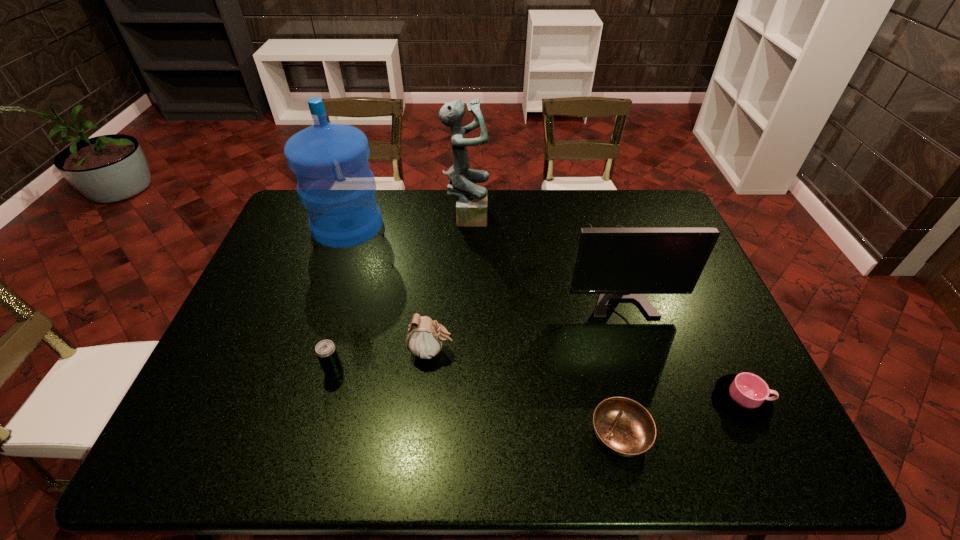
Where is `free space between the water jug and the soup bowl`? The image size is (960, 540). free space between the water jug and the soup bowl is located at coordinates (484, 330).

Image resolution: width=960 pixels, height=540 pixels. What are the coordinates of `empty location between the pouch and the sculpture` in the screenshot? It's located at (449, 283).

You are a GUI agent. You are given a task and a screenshot of the screen. Output one action in this format:
    pyautogui.click(x=<x>, y=<y>)
    Task: Click on the free space between the soup bowl and the sculpture
    This screenshot has height=540, width=960.
    Given the screenshot: What is the action you would take?
    543,325

At what (x,y) coordinates should I click in order to perform the action: click on free spot between the water jug and the third tallest object. Please return your answer as a coordinate pair (x, y). The height and width of the screenshot is (540, 960). Looking at the image, I should click on (480, 248).

Locate an element on the screen. The image size is (960, 540). free space between the third tallest object and the water jug is located at coordinates (480, 248).

You are a GUI agent. You are given a task and a screenshot of the screen. Output one action in this format:
    pyautogui.click(x=<x>, y=<y>)
    Task: Click on the free space between the computer monitor and the sculpture
    The height and width of the screenshot is (540, 960).
    Given the screenshot: What is the action you would take?
    pyautogui.click(x=540, y=242)

Where is `vacant point located between the beer can and the computer monitor`? This screenshot has height=540, width=960. vacant point located between the beer can and the computer monitor is located at coordinates (473, 320).

Select which object is the sixth closest to the beer can. Please provide its 2D coordinates. Your answer should be formatted as a tuple, i.e. [(x, y)], where the tuple contains the x and y coordinates of a point satisfying the conditions above.

[(745, 396)]

The image size is (960, 540). Find the location of `object that is the third closest one to the third shortest object`. object that is the third closest one to the third shortest object is located at coordinates (624, 427).

The image size is (960, 540). Identify the location of free location that satisfies the following two spatial constraints: 1. on the back side of the shortest object; 2. on the face of the sculpture. (568, 215).